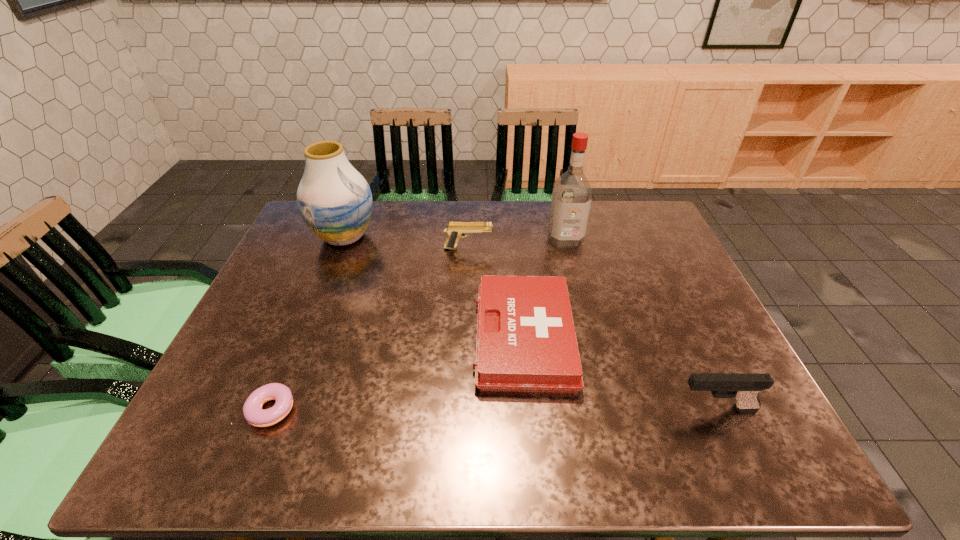
The height and width of the screenshot is (540, 960). Identify the location of object that is the third closest one to the doughnut. (455, 230).

What are the coordinates of `free space in the image that satisfies the following two spatial constraints: 1. on the front-facing side of the liquor; 2. at the barrel of the third shortest object` in the screenshot? It's located at (567, 248).

Where is `vacant area that satisfies the following two spatial constraints: 1. at the barrel of the left pistol; 2. on the back side of the first-aid kit`? Image resolution: width=960 pixels, height=540 pixels. vacant area that satisfies the following two spatial constraints: 1. at the barrel of the left pistol; 2. on the back side of the first-aid kit is located at coordinates (466, 338).